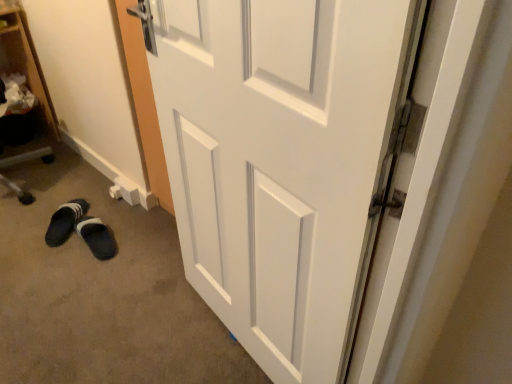
Question: From the image's perspective, is black fabric slipper at lower left positioned above or below white glossy door at center?

Choices:
 (A) above
 (B) below

Answer: (B)

Question: Looking at the image, does black fabric slipper at lower left seem bigger or smaller compared to white glossy door at center?

Choices:
 (A) small
 (B) big

Answer: (A)

Question: Estimate the real-world distances between objects in this image. Which object is farther from the black suede slipper at lower left?

Choices:
 (A) black fabric slipper at lower left
 (B) white glossy door at center
 (C) wooden bookshelf at left

Answer: (B)

Question: Which object is the farthest from the wooden bookshelf at left?

Choices:
 (A) black suede slipper at lower left
 (B) black fabric slipper at lower left
 (C) white glossy door at center

Answer: (C)